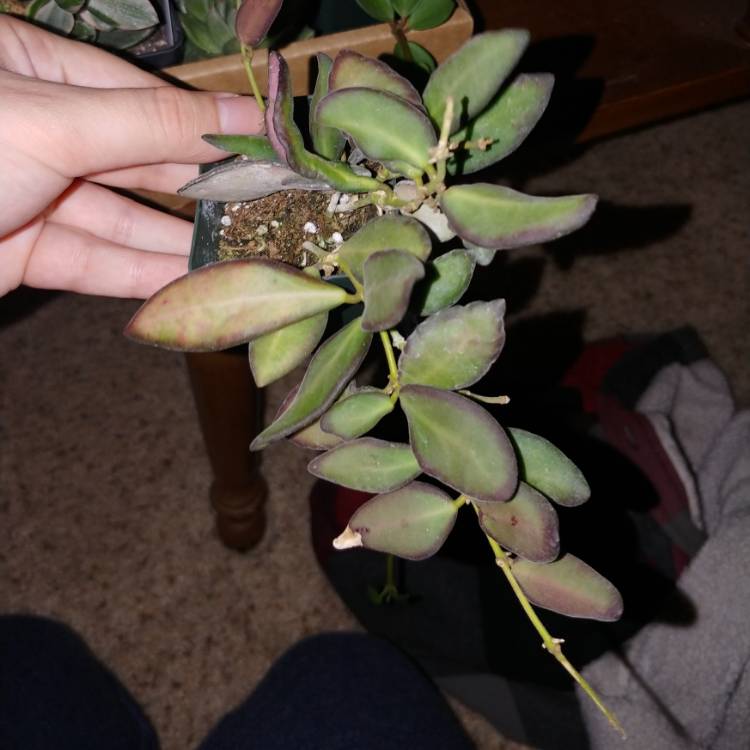
Find the location of a particular element. The image size is (750, 750). leg of a table is located at coordinates (232, 400).